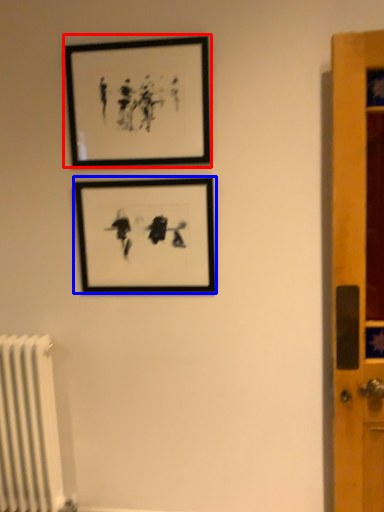
Question: Which object appears farthest to the camera in this image, picture frame (highlighted by a red box) or picture frame (highlighted by a blue box)?

Choices:
 (A) picture frame
 (B) picture frame

Answer: (B)